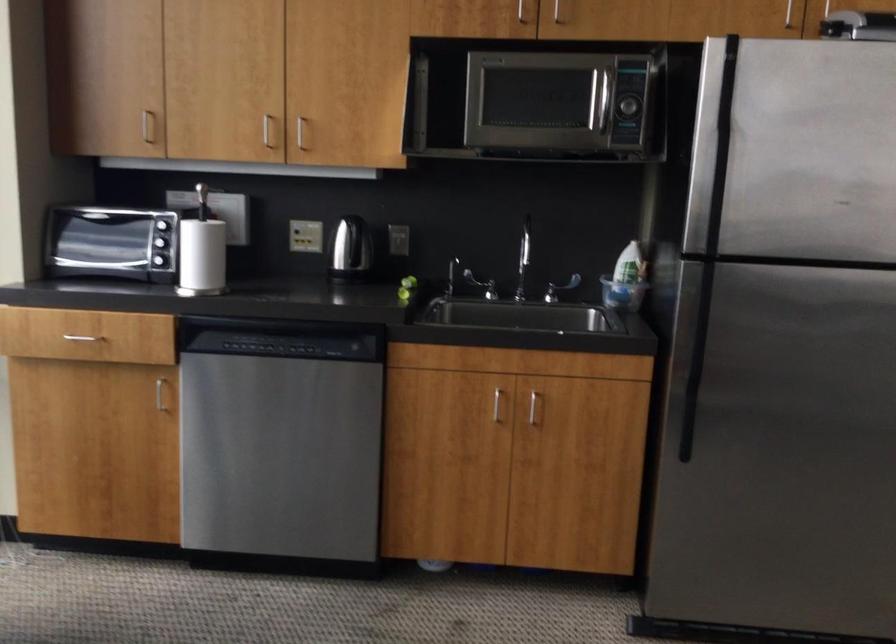
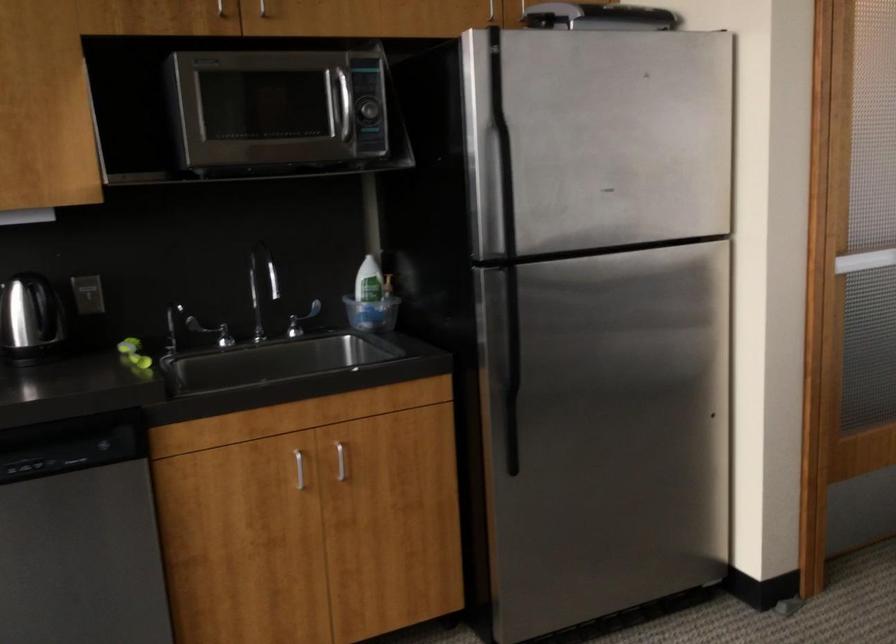
Question: How did the camera likely rotate?

Choices:
 (A) Left
 (B) Right
 (C) Up
 (D) Down

Answer: (B)